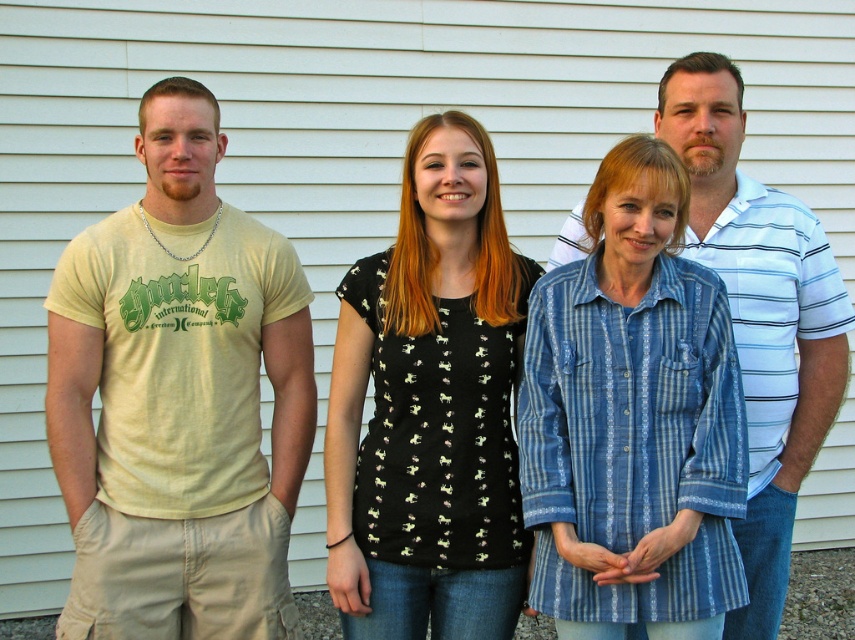
Question: Which of the following is the closest to the observer?

Choices:
 (A) white striped polo shirt at center
 (B) light yellow t-shirt at left
 (C) black printed blouse at center

Answer: (C)

Question: Which point is farther to the camera?

Choices:
 (A) black printed blouse at center
 (B) light yellow t-shirt at left
 (C) white striped polo shirt at center

Answer: (B)

Question: Does black printed blouse at center lie in front of white striped polo shirt at center?

Choices:
 (A) no
 (B) yes

Answer: (B)

Question: Can you confirm if black printed blouse at center is positioned above white striped polo shirt at center?

Choices:
 (A) no
 (B) yes

Answer: (A)

Question: Estimate the real-world distances between objects in this image. Which object is closer to the light yellow t-shirt at left?

Choices:
 (A) black printed blouse at center
 (B) white striped polo shirt at center

Answer: (A)

Question: Does light yellow t-shirt at left appear on the left side of black printed blouse at center?

Choices:
 (A) no
 (B) yes

Answer: (B)